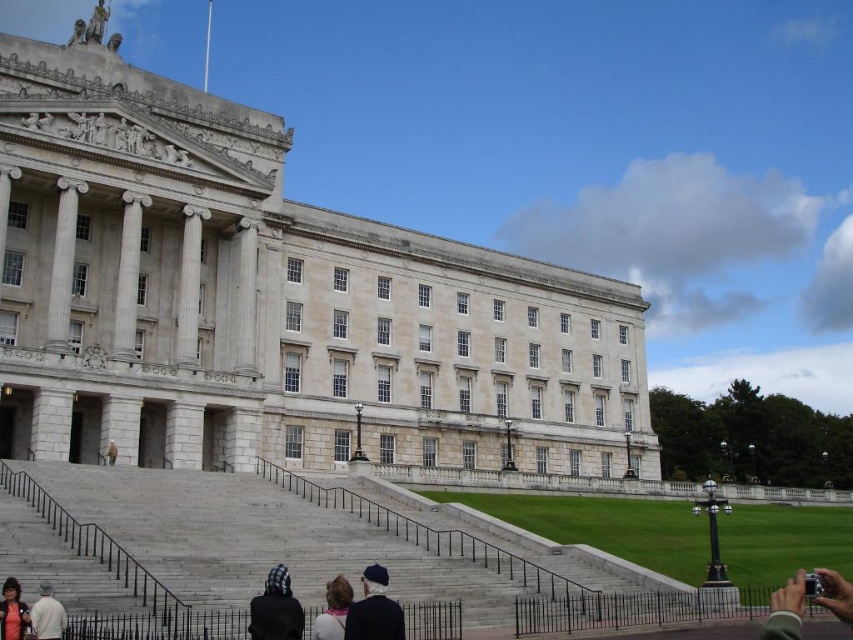
Who is more forward, (271, 570) or (329, 612)?

Result: Point (329, 612) is more forward.

Based on the photo, who is taller, black knit cap at lower center or light brown hair at lower center?

Standing taller between the two is black knit cap at lower center.

At what (x,y) coordinates should I click in order to perform the action: click on black knit cap at lower center. Please return your answer as a coordinate pair (x, y). The width and height of the screenshot is (853, 640). Looking at the image, I should click on (276, 609).

Where is `black knit cap at lower center`? black knit cap at lower center is located at coordinates (276, 609).

Is point (277, 616) closer to camera compared to point (39, 588)?

Yes, it is.

Who is shorter, black knit cap at lower center or white cotton shirt at lower left?

Standing shorter between the two is white cotton shirt at lower left.

What do you see at coordinates (276, 609) in the screenshot?
I see `black knit cap at lower center` at bounding box center [276, 609].

Image resolution: width=853 pixels, height=640 pixels. In order to click on black knit cap at lower center in this screenshot , I will do `click(276, 609)`.

Measure the distance from matte black camera at lower right to light brown leather jacket at lower center.

matte black camera at lower right and light brown leather jacket at lower center are 33.17 meters apart.

Does matte black camera at lower right lie behind light brown leather jacket at lower center?

No, matte black camera at lower right is closer to the viewer.

Which is in front, point (825, 570) or point (109, 452)?

Positioned in front is point (109, 452).

Find the location of a particular element. This screenshot has height=640, width=853. matte black camera at lower right is located at coordinates (786, 609).